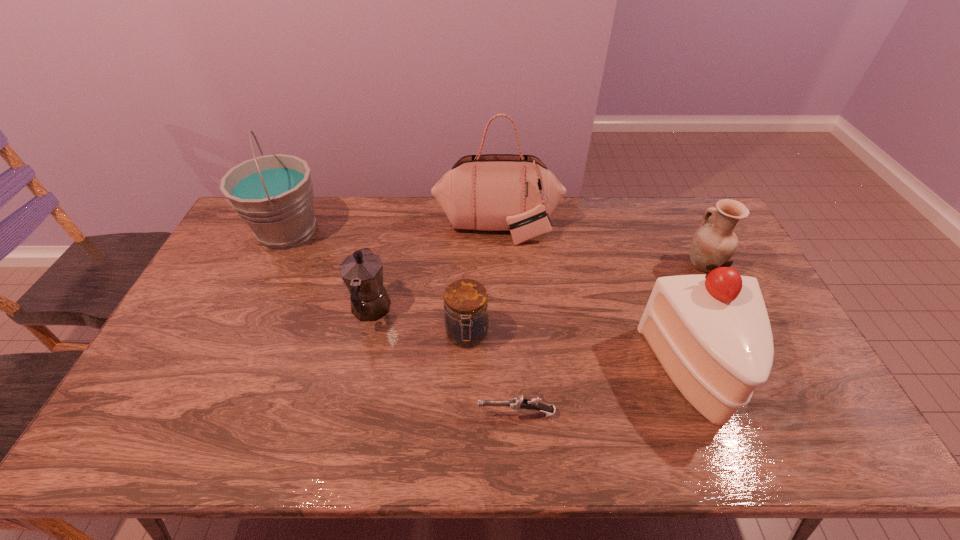
Image resolution: width=960 pixels, height=540 pixels. Identify the location of free space between the shortest object and the pottery. (610, 339).

Where is `unoccupied area between the bucket and the gun`? The height and width of the screenshot is (540, 960). unoccupied area between the bucket and the gun is located at coordinates (402, 322).

This screenshot has height=540, width=960. Find the location of `free area in between the pottery and the shortest object`. free area in between the pottery and the shortest object is located at coordinates (610, 339).

Identify the location of vacant space that is in between the cake and the coffeepot. This screenshot has width=960, height=540. (535, 342).

Find the location of a particular element. Image resolution: width=960 pixels, height=540 pixels. free space that is in between the coffeepot and the fifth shortest object is located at coordinates (535, 342).

Identify the location of object that ranks as the fifth closest to the sixth tallest object. (273, 194).

At what (x,y) coordinates should I click in order to perform the action: click on object that is the third closest one to the jar. Please return your answer as a coordinate pair (x, y). Looking at the image, I should click on (493, 192).

This screenshot has height=540, width=960. Find the location of `free space that satisfies the following two spatial constraints: 1. on the side of the handbag with the attached pouch; 2. on the left side of the fifth shortest object`. free space that satisfies the following two spatial constraints: 1. on the side of the handbag with the attached pouch; 2. on the left side of the fifth shortest object is located at coordinates (504, 374).

Identify the location of free location that satisfies the following two spatial constraints: 1. on the side of the handbag with the attached pouch; 2. on the right side of the pottery. (499, 265).

The height and width of the screenshot is (540, 960). In order to click on free space that satisfies the following two spatial constraints: 1. on the side of the third tallest object with the attached pouch; 2. on the left side of the handbag in this screenshot , I will do `click(504, 374)`.